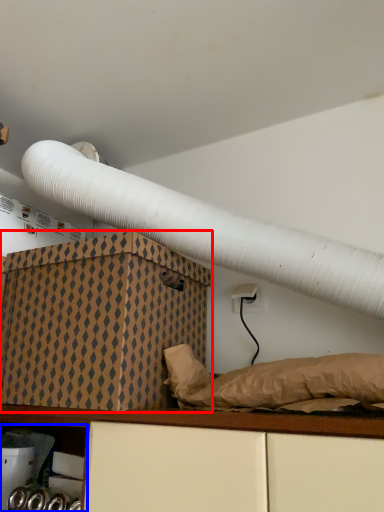
Question: Which object appears closest to the camera in this image, box (highlighted by a red box) or shelf (highlighted by a blue box)?

Choices:
 (A) box
 (B) shelf

Answer: (A)